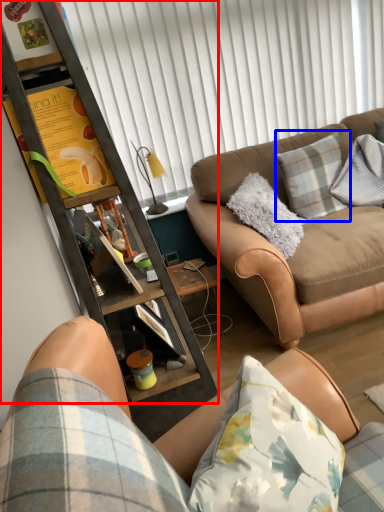
Question: Which object is closer to the camera taking this photo, cabinetry (highlighted by a red box) or pillow (highlighted by a blue box)?

Choices:
 (A) cabinetry
 (B) pillow

Answer: (A)